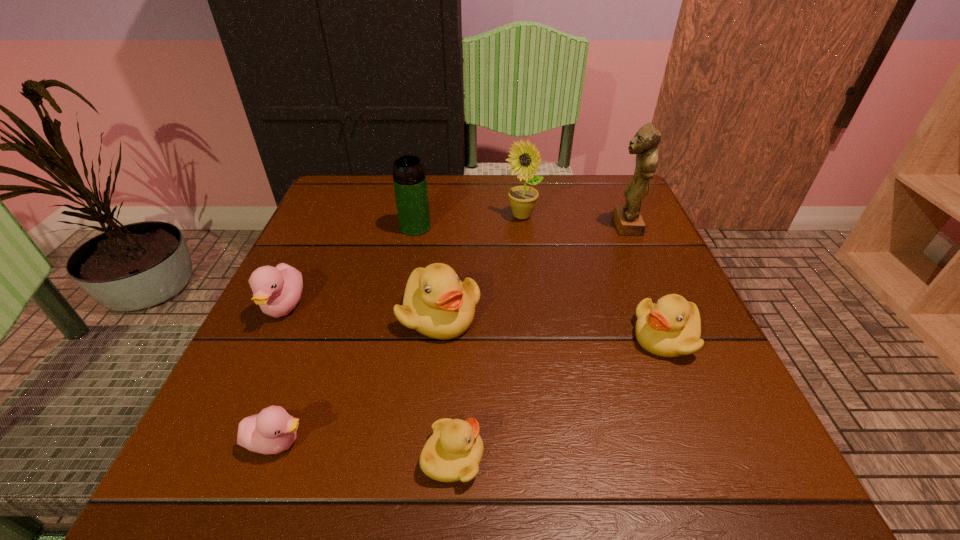
The image size is (960, 540). In the image, there is a desktop. What are the coordinates of `vacant region at the near edge` in the screenshot? It's located at (543, 448).

This screenshot has width=960, height=540. Find the location of `vacant space at the left edge of the desktop`. vacant space at the left edge of the desktop is located at coordinates pyautogui.click(x=344, y=229).

This screenshot has width=960, height=540. Find the location of `blank area at the right edge`. blank area at the right edge is located at coordinates (740, 407).

I want to click on vacant space at the far left corner, so click(335, 190).

The width and height of the screenshot is (960, 540). I want to click on vacant space at the far right corner of the desktop, so click(x=589, y=211).

Find the location of a particular element. The width and height of the screenshot is (960, 540). free spot between the biggest yellow duckling and the tallest object is located at coordinates tap(532, 270).

Identify the location of vacant space that's between the farther pink duckling and the green thermos bottle. The height and width of the screenshot is (540, 960). (349, 267).

The height and width of the screenshot is (540, 960). What are the coordinates of `vacant area that lies between the smallest yellow duckling and the biggest yellow duckling` in the screenshot? It's located at (446, 386).

Image resolution: width=960 pixels, height=540 pixels. In order to click on free space between the second biggest yellow duckling and the nearest yellow duckling in this screenshot , I will do `click(559, 397)`.

This screenshot has height=540, width=960. Find the location of `blank region between the bigger pink duckling and the green thermos bottle`. blank region between the bigger pink duckling and the green thermos bottle is located at coordinates (349, 267).